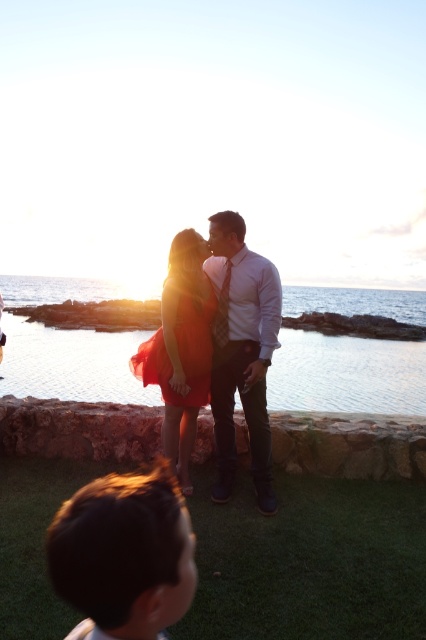
Does transparent water at center appear under matte white shirt at center?

Incorrect, transparent water at center is not positioned below matte white shirt at center.

Who is more distant from viewer, [71,394] or [244,276]?

Positioned behind is point [71,394].

Locate an element on the screen. transparent water at center is located at coordinates (347, 374).

Can you confirm if transparent water at center is taller than satin red dress at center?

Yes, transparent water at center is taller than satin red dress at center.

In the scene shown: Who is more forward, (294, 392) or (147, 380)?

Point (147, 380) is more forward.

Where is `transparent water at center`? The width and height of the screenshot is (426, 640). transparent water at center is located at coordinates (347, 374).

You are a GUI agent. You are given a task and a screenshot of the screen. Output one action in this format:
    pyautogui.click(x=<x>, y=<y>)
    Task: Click on the transparent water at center
    Image resolution: width=426 pixels, height=640 pixels.
    Given the screenshot: What is the action you would take?
    pyautogui.click(x=347, y=374)

Find the location of `matte white shirt at center`. matte white shirt at center is located at coordinates (241, 352).

Where is `matte white shirt at center`? This screenshot has height=640, width=426. matte white shirt at center is located at coordinates (241, 352).

I want to click on matte white shirt at center, so click(x=241, y=352).